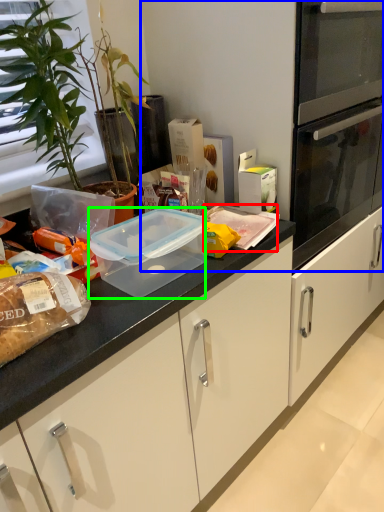
Question: Considering the real-world distances, which object is farthest from food (highlighted by a red box)? fridge (highlighted by a blue box) or appliance (highlighted by a green box)?

Choices:
 (A) fridge
 (B) appliance

Answer: (A)